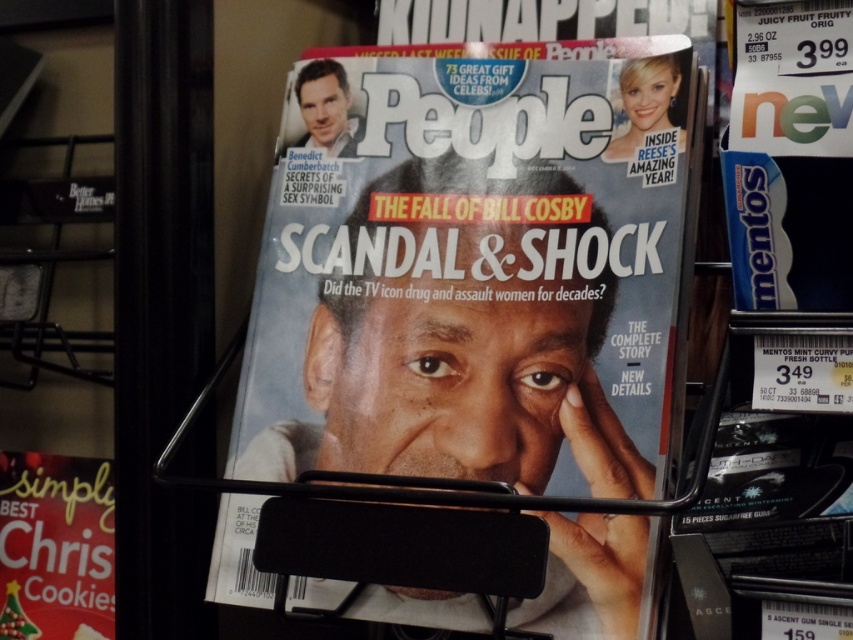
Can you confirm if matte paper magazine at center is positioned below blue glossy mentos at right?

Yes, matte paper magazine at center is below blue glossy mentos at right.

Consider the image. Measure the distance between matte paper magazine at center and blue glossy mentos at right.

matte paper magazine at center is 25.99 centimeters away from blue glossy mentos at right.

Between point (585, 172) and point (840, 36), which one is positioned in front?

Positioned in front is point (840, 36).

Where is `matte paper magazine at center`? matte paper magazine at center is located at coordinates (476, 266).

Does blue glossy mentos at right have a lesser width compared to matte red christmas cookies at lower left?

Correct, blue glossy mentos at right's width is less than matte red christmas cookies at lower left's.

You are a GUI agent. You are given a task and a screenshot of the screen. Output one action in this format:
    pyautogui.click(x=<x>, y=<y>)
    Task: Click on the blue glossy mentos at right
    This screenshot has width=853, height=640.
    Given the screenshot: What is the action you would take?
    pyautogui.click(x=790, y=156)

This screenshot has width=853, height=640. I want to click on blue glossy mentos at right, so click(790, 156).

Who is higher up, matte paper magazine at center or matte red christmas cookies at lower left?

Positioned higher is matte paper magazine at center.

Is point (585, 595) farther from camera compared to point (109, 628)?

No, it is not.

Is point (538, 440) positioned after point (96, 554)?

No.

Image resolution: width=853 pixels, height=640 pixels. What are the coordinates of `matte paper magazine at center` in the screenshot? It's located at (476, 266).